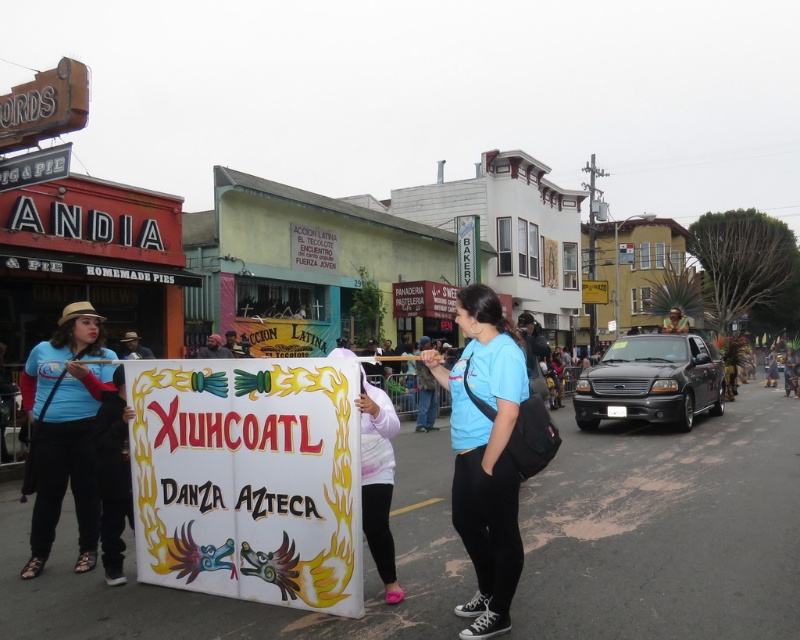
Can you confirm if white fabric sign at center is thinner than blue t-shirt at center?

No, white fabric sign at center is not thinner than blue t-shirt at center.

Does point (281, 518) come farther from viewer compared to point (504, 588)?

Yes, point (281, 518) is behind point (504, 588).

Is point (154, 582) closer to viewer compared to point (508, 413)?

No, it is not.

Where is `white fabric sign at center`? white fabric sign at center is located at coordinates (248, 480).

Does white fabric sign at center have a lesser height compared to matte blue shirt at left?

Correct, white fabric sign at center is not as tall as matte blue shirt at left.

Which of these two, white fabric sign at center or matte blue shirt at left, stands shorter?

white fabric sign at center is shorter.

Is point (220, 509) farther from viewer compared to point (78, 540)?

No, (220, 509) is in front of (78, 540).

Where is `white fabric sign at center`? This screenshot has height=640, width=800. white fabric sign at center is located at coordinates (248, 480).

Between blue t-shirt at center and matte blue shirt at left, which one has more height?

Standing taller between the two is matte blue shirt at left.

Is the position of blue t-shirt at center more distant than that of matte blue shirt at left?

No, blue t-shirt at center is closer to the viewer.

Locate an element on the screen. The height and width of the screenshot is (640, 800). blue t-shirt at center is located at coordinates (484, 454).

Where is `blue t-shirt at center`? This screenshot has width=800, height=640. blue t-shirt at center is located at coordinates (484, 454).